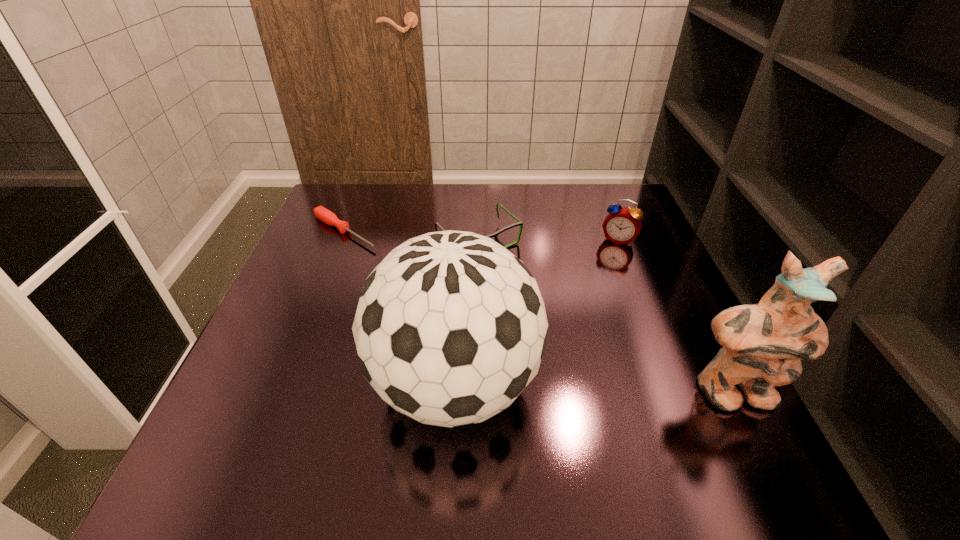
The height and width of the screenshot is (540, 960). Find the location of `soccer ball`. soccer ball is located at coordinates (450, 328).

Locate an element on the screen. This screenshot has height=540, width=960. figurine is located at coordinates (763, 344).

This screenshot has height=540, width=960. Find the location of `spectacles`. spectacles is located at coordinates (519, 223).

Locate an element on the screen. the third shortest object is located at coordinates (622, 225).

The height and width of the screenshot is (540, 960). I want to click on the shortest object, so click(x=320, y=212).

You are a GUI agent. You are given a task and a screenshot of the screen. Output one action in this format:
    pyautogui.click(x=<x>, y=<y>)
    Task: Click on the leftmost object
    The height and width of the screenshot is (540, 960).
    Given the screenshot: What is the action you would take?
    pyautogui.click(x=320, y=212)

Where is `blank area located 0.250m on the left of the soccer ball`? blank area located 0.250m on the left of the soccer ball is located at coordinates (238, 384).

You are a GUI agent. You are given a task and a screenshot of the screen. Output one action in this format:
    pyautogui.click(x=<x>, y=<y>)
    Task: Click on the vacant area situated 0.090m on the lens of the second shortest object
    This screenshot has width=960, height=540.
    Given the screenshot: What is the action you would take?
    pyautogui.click(x=522, y=284)

Where is `free space located 0.320m on the lens of the second shortest object`? This screenshot has height=540, width=960. free space located 0.320m on the lens of the second shortest object is located at coordinates (588, 350).

At what (x,y) coordinates should I click in order to perform the action: click on vacant space situated on the lens of the second shortest object. Please return your answer as a coordinate pair (x, y). The height and width of the screenshot is (540, 960). Looking at the image, I should click on (606, 368).